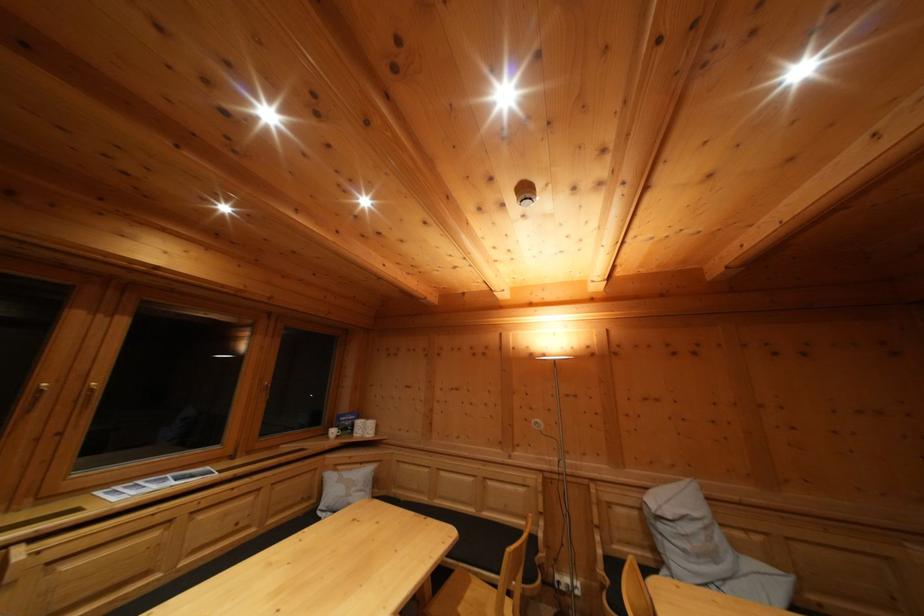
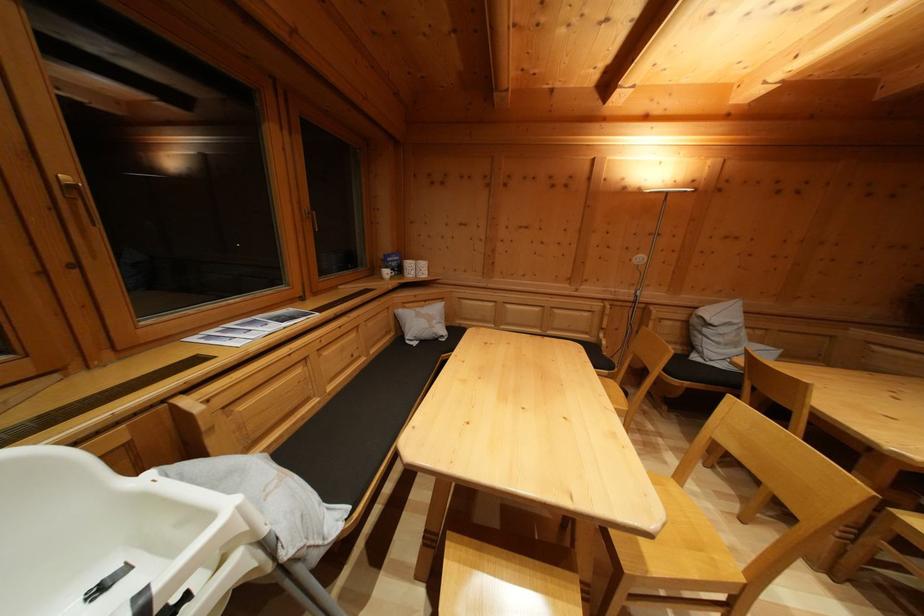
Find the pixel in the second image that matches (x=368, y=469) in the first image.

(431, 308)